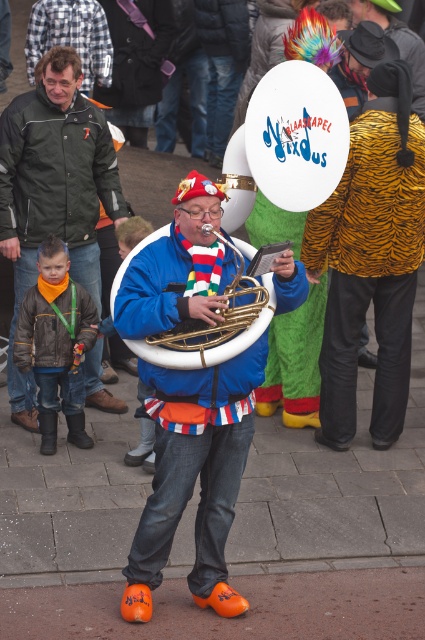
Question: Considering the real-world distances, which object is closest to the brushed metal face at upper left?

Choices:
 (A) green matte jacket at upper left
 (B) gold brass trumpet at center

Answer: (A)

Question: Which point is farther to the camera?

Choices:
 (A) brushed metal face at upper left
 (B) green matte jacket at upper left
 (C) brown leather jacket at lower left

Answer: (A)

Question: Does gold brass tuba at center have a smaller size compared to brown leather jacket at lower left?

Choices:
 (A) yes
 (B) no

Answer: (B)

Question: Does gold brass tuba at center have a greater width compared to gold brass trumpet at center?

Choices:
 (A) yes
 (B) no

Answer: (A)

Question: Is gold brass tuba at center wider than brown leather jacket at lower left?

Choices:
 (A) no
 (B) yes

Answer: (B)

Question: Which point is closer to the camera?

Choices:
 (A) gold brass tuba at center
 (B) brown leather jacket at lower left
 (C) gold brass trumpet at center
 (D) green matte jacket at upper left

Answer: (C)